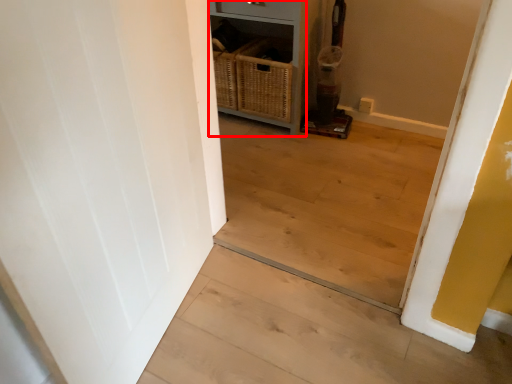
Question: From the image's perspective, where is dresser (annotated by the red box) located relative to stairwell?

Choices:
 (A) below
 (B) above

Answer: (B)